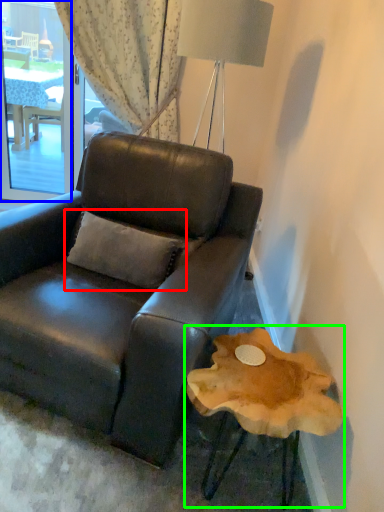
Question: Considering the real-world distances, which object is closest to pillow (highlighted by a red box)? window screen (highlighted by a blue box) or round table (highlighted by a green box).

Choices:
 (A) window screen
 (B) round table

Answer: (B)